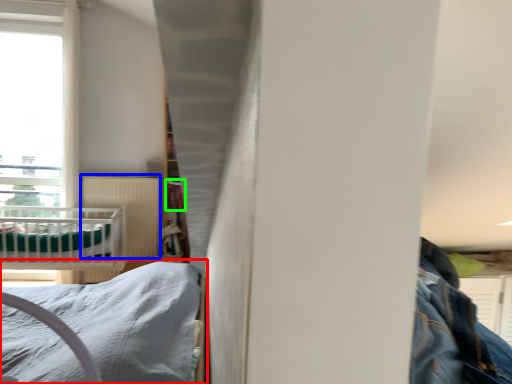
Question: Based on their relative distances, which object is nearer to bed (highlighted by a red box)? Choose from radiator (highlighted by a blue box) and shelf (highlighted by a green box).

Choices:
 (A) radiator
 (B) shelf

Answer: (B)